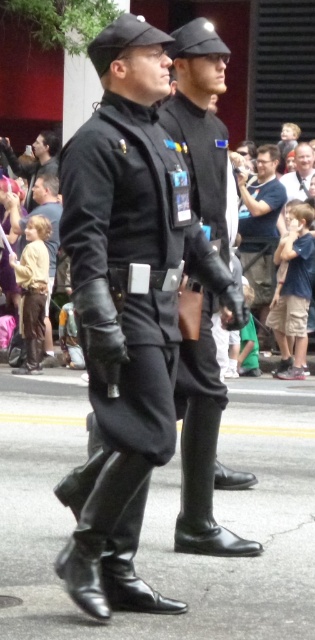
Question: Is black leather boot at lower left smaller than brown leather pants at lower left?

Choices:
 (A) no
 (B) yes

Answer: (B)

Question: Is matte black shirt at center smaller than brown leather pants at lower left?

Choices:
 (A) no
 (B) yes

Answer: (B)

Question: Observing the image, what is the correct spatial positioning of shiny black boots at center in reference to matte black jacket at upper left?

Choices:
 (A) below
 (B) above

Answer: (A)

Question: Which of the following is the closest to the observer?

Choices:
 (A) (198, 525)
 (B) (129, 280)

Answer: (B)

Question: Which point is closer to the camera?

Choices:
 (A) (274, 170)
 (B) (216, 477)
 (C) (194, 67)
 (D) (136, 260)

Answer: (D)

Question: Which point appears closest to the camera in this image?

Choices:
 (A) (66, 220)
 (B) (193, 65)
 (C) (218, 419)
 (D) (257, 276)

Answer: (A)